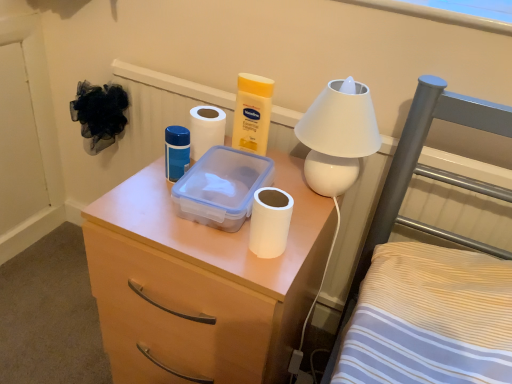
Question: Considering the relative positions of white matte toilet paper at center, which is the first toilet paper from left to right, and white glossy lamp at upper right in the image provided, is white matte toilet paper at center, which is the first toilet paper from left to right, to the right of white glossy lamp at upper right from the viewer's perspective?

Choices:
 (A) yes
 (B) no

Answer: (B)

Question: Does white matte toilet paper at center, which is the 1th toilet paper in top-to-bottom order, appear on the left side of white glossy lamp at upper right?

Choices:
 (A) no
 (B) yes

Answer: (B)

Question: Can you confirm if white matte toilet paper at center, acting as the 2th toilet paper starting from the right, is thinner than white glossy lamp at upper right?

Choices:
 (A) no
 (B) yes

Answer: (B)

Question: Can you confirm if white matte toilet paper at center, which is the first toilet paper from left to right, is bigger than white glossy lamp at upper right?

Choices:
 (A) no
 (B) yes

Answer: (A)

Question: Is white matte toilet paper at center, arranged as the 1th toilet paper when viewed from the back, further to camera compared to white glossy lamp at upper right?

Choices:
 (A) yes
 (B) no

Answer: (A)

Question: Is white matte toilet paper at center, arranged as the 1th toilet paper when viewed from the back, aimed at white glossy lamp at upper right?

Choices:
 (A) no
 (B) yes

Answer: (A)

Question: Considering the relative sizes of blue matte container at center and white glossy lamp at upper right in the image provided, is blue matte container at center bigger than white glossy lamp at upper right?

Choices:
 (A) no
 (B) yes

Answer: (A)

Question: Is blue matte container at center shorter than white glossy lamp at upper right?

Choices:
 (A) yes
 (B) no

Answer: (A)

Question: Can you confirm if blue matte container at center is positioned to the right of white glossy lamp at upper right?

Choices:
 (A) no
 (B) yes

Answer: (A)

Question: Considering the relative sizes of blue matte container at center and white glossy lamp at upper right in the image provided, is blue matte container at center smaller than white glossy lamp at upper right?

Choices:
 (A) no
 (B) yes

Answer: (B)

Question: Is blue matte container at center facing towards white glossy lamp at upper right?

Choices:
 (A) no
 (B) yes

Answer: (A)

Question: From a real-world perspective, is blue matte container at center on white glossy lamp at upper right?

Choices:
 (A) yes
 (B) no

Answer: (B)

Question: Is white matte toilet paper at center, acting as the 2th toilet paper starting from the right, thinner than transparent plastic storage box at center?

Choices:
 (A) no
 (B) yes

Answer: (B)